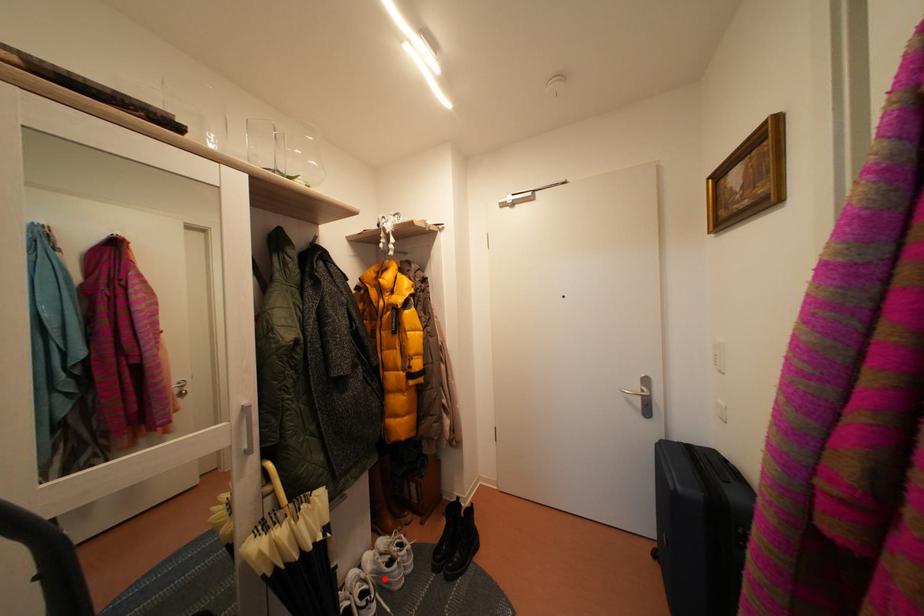
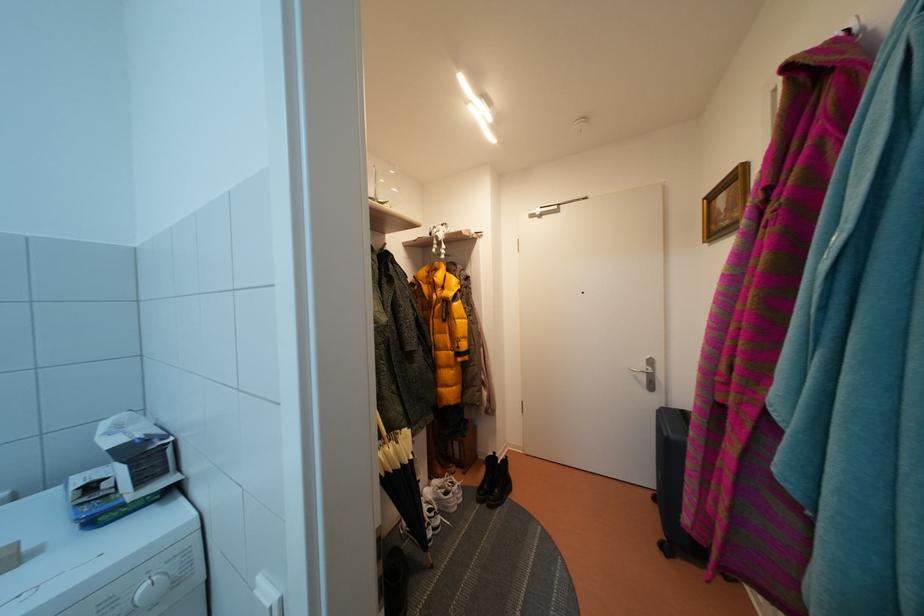
In the second image, find the point that corresponds to the highlighted location in the first image.

(444, 506)